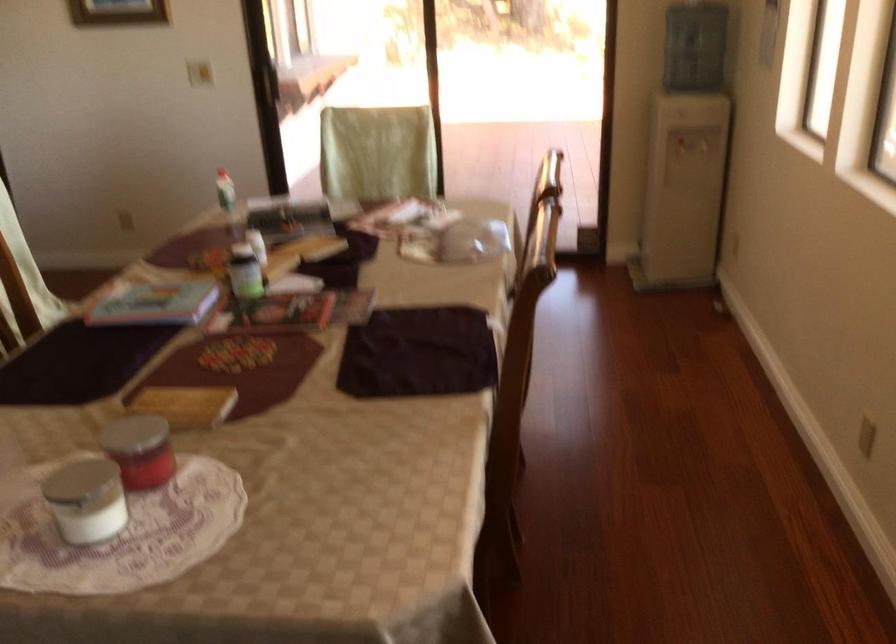
The width and height of the screenshot is (896, 644). Describe the element at coordinates (366, 218) in the screenshot. I see `the chair sitting surface` at that location.